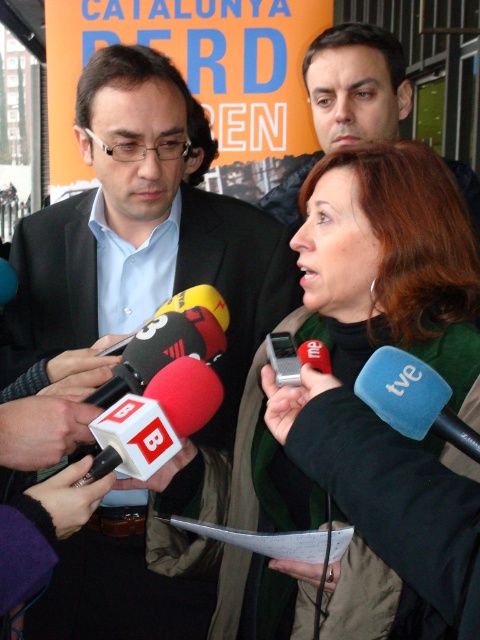
You are a photographer at the press conference. You need to capture a closeup of the blue rubber microphone at center and the green wool scarf at center. Since your camera can only focus on one object at a time, which object should you focus on first to ensure it appears larger in the photo?

The green wool scarf at center is wider than the blue rubber microphone at center, so focusing on the green wool scarf at center first would ensure it appears larger in the photo.

You are a photographer at the press conference. You need to take a photo of the woman speaking while ensuring both the green wool scarf at center and the blue rubber microphone at center are visible. Based on their positions, which object should you focus on first to ensure both are in frame?

The green wool scarf at center is below the blue rubber microphone at center. To ensure both are in frame, focus on the blue rubber microphone at center first since it is higher up, allowing the scarf to naturally fall into the lower part of the photo.

You are a photographer at the press conference. You need to capture a closeup shot of the blue rubber microphone at center without the green wool scarf at center appearing in the frame. Is this possible given their sizes?

The green wool scarf at center is bigger than the blue rubber microphone at center. Since the scarf is larger, it may block the microphone in the frame unless adjusted. However, since both are at the center, it might be challenging to avoid the scarf entirely in the closeup.